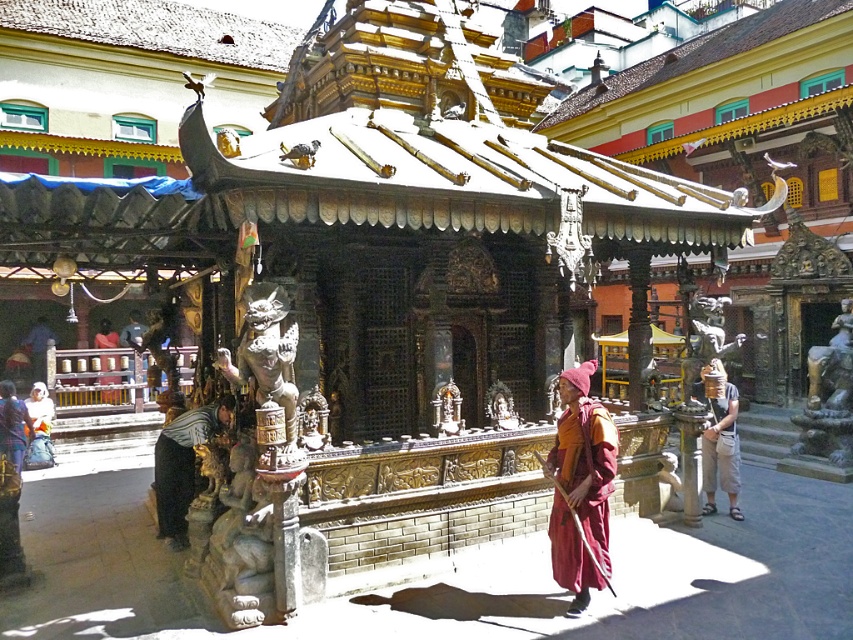
Question: Which of the following is the closest to the observer?

Choices:
 (A) striped fabric shirt at center
 (B) tan fabric hat at right
 (C) bronze statue at right

Answer: (A)

Question: In this image, where is bronze/golden statue at center located relative to dark brown wooden statue at lower left?

Choices:
 (A) left
 (B) right

Answer: (B)

Question: Can you confirm if maroon woolen robe at center is positioned below striped fabric shirt at center?

Choices:
 (A) yes
 (B) no

Answer: (B)

Question: Which point appears farthest from the camera in this image?

Choices:
 (A) (265, 358)
 (B) (598, 476)

Answer: (B)

Question: Which point appears farthest from the camera in this image?

Choices:
 (A) (6, 424)
 (B) (184, 420)
 (C) (712, 401)

Answer: (C)

Question: Does maroon woolen robe at center come behind striped fabric shirt at center?

Choices:
 (A) no
 (B) yes

Answer: (A)